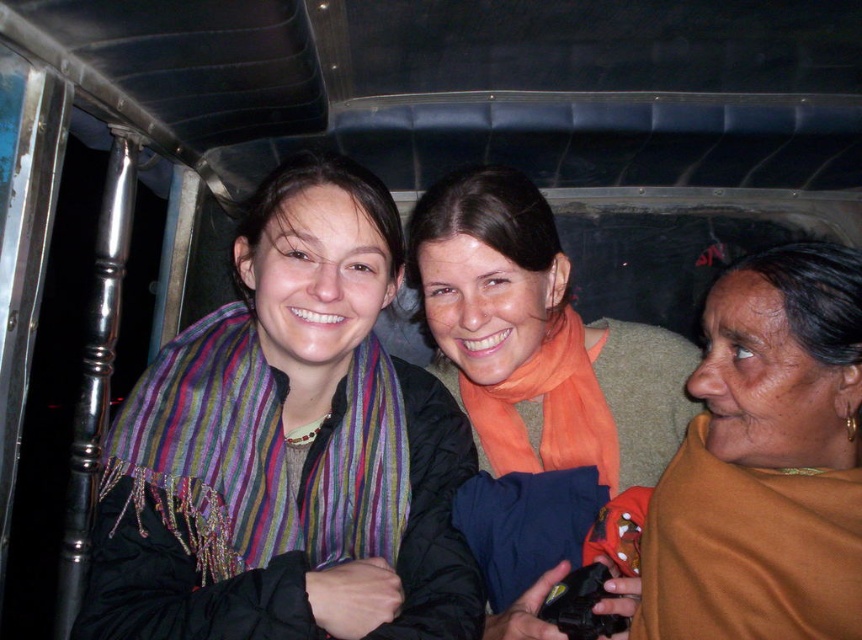
What do you see at coordinates (288, 449) in the screenshot?
I see `striped scarf at center` at bounding box center [288, 449].

Measure the distance from striped scarf at center to brown fabric at right.

They are 15.15 inches apart.

Find the location of a particular element. striped scarf at center is located at coordinates pos(288,449).

Find the location of a particular element. The height and width of the screenshot is (640, 862). striped scarf at center is located at coordinates (288, 449).

Which of these two, orange scarf at center or multicolored woven scarf at left, stands taller?

Standing taller between the two is orange scarf at center.

Is orange scarf at center thinner than multicolored woven scarf at left?

Incorrect, orange scarf at center's width is not less than multicolored woven scarf at left's.

Does point (632, 410) come closer to viewer compared to point (336, 556)?

No, it is not.

Locate an element on the screen. Image resolution: width=862 pixels, height=640 pixels. orange scarf at center is located at coordinates (535, 384).

Is multicolored woven scarf at left to the left of orange silk scarf at center from the viewer's perspective?

Indeed, multicolored woven scarf at left is positioned on the left side of orange silk scarf at center.

Is point (336, 424) positioned behind point (486, 442)?

That is False.

Image resolution: width=862 pixels, height=640 pixels. I want to click on multicolored woven scarf at left, so click(x=258, y=456).